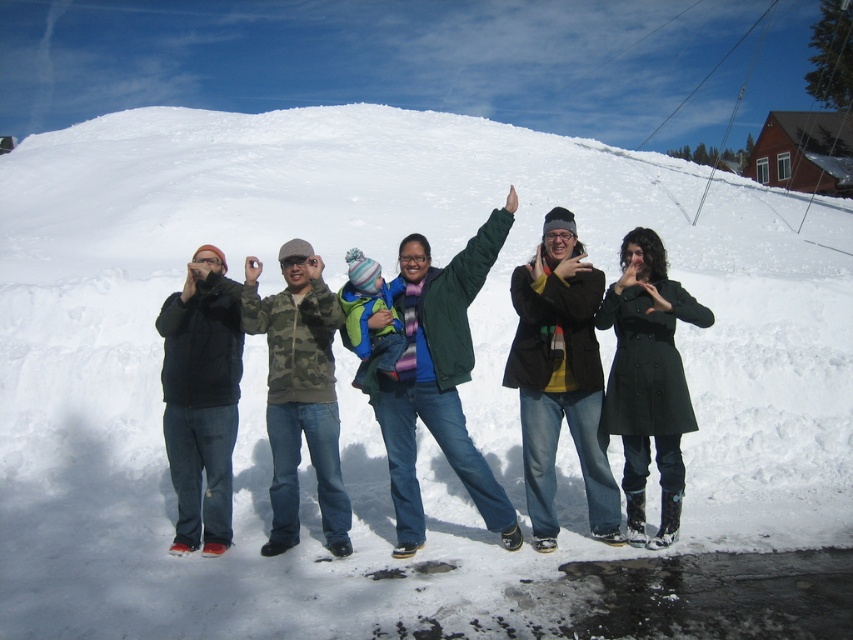
Question: Can you confirm if black matte jacket at center is positioned to the left of black matte jacket at left?

Choices:
 (A) no
 (B) yes

Answer: (A)

Question: Which object is farther from the camera taking this photo?

Choices:
 (A) black matte jacket at left
 (B) green woolen jacket at center
 (C) black matte jacket at center
 (D) black wool coat at center

Answer: (A)

Question: Can you confirm if green woolen jacket at center is wider than black matte jacket at center?

Choices:
 (A) yes
 (B) no

Answer: (A)

Question: Which point is closer to the camera?

Choices:
 (A) black matte jacket at center
 (B) black matte jacket at left
 (C) green woolen jacket at center

Answer: (C)

Question: Which object is the closest to the black matte jacket at center?

Choices:
 (A) black matte jacket at left
 (B) black wool coat at center

Answer: (B)

Question: Does green woolen jacket at center have a smaller size compared to black matte jacket at left?

Choices:
 (A) no
 (B) yes

Answer: (A)